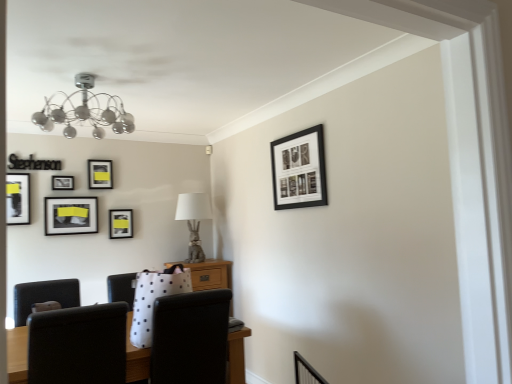
This screenshot has width=512, height=384. Describe the element at coordinates (193, 221) in the screenshot. I see `gray stone rabbit at center` at that location.

In order to click on matte black picture frame at left, positioned as the third picture frame in front-to-back order in this screenshot , I will do `click(71, 215)`.

From the picture: How much space does matte black picture frame at upper left, which is the third picture frame from back to front, occupy vertically?

4.93 inches.

At what (x,y) coordinates should I click in order to perform the action: click on black matte picture frame at upper right, which is counted as the 6th picture frame, starting from the left. Please return your answer as a coordinate pair (x, y). Looking at the image, I should click on (298, 169).

The height and width of the screenshot is (384, 512). Find the location of `black fabric chair at lower center`. black fabric chair at lower center is located at coordinates (190, 338).

This screenshot has height=384, width=512. I want to click on the 4th picture frame in front of the gray stone rabbit at center, counting from the anchor's position, so click(298, 169).

From a real-world perspective, is gray stone rabbit at center over black matte picture frame at upper right, acting as the 6th picture frame starting from the back?

No.

Is gray stone rabbit at center facing towards black matte picture frame at upper right, the 1th picture frame positioned from the front?

Yes, gray stone rabbit at center faces towards black matte picture frame at upper right, the 1th picture frame positioned from the front.

Considering their positions, is gray stone rabbit at center located in front of or behind black matte picture frame at upper right, arranged as the first picture frame when viewed from the right?

gray stone rabbit at center is behind black matte picture frame at upper right, arranged as the first picture frame when viewed from the right.

Consider the image. Is matte black picture frame at upper left, placed as the fifth picture frame when sorted from front to back, facing towards black fabric chair at lower center?

No, matte black picture frame at upper left, placed as the fifth picture frame when sorted from front to back, is not aimed at black fabric chair at lower center.

Would you say black fabric chair at lower center is part of matte black picture frame at upper left, which is counted as the second picture frame, starting from the back,'s contents?

No, matte black picture frame at upper left, which is counted as the second picture frame, starting from the back, does not contain black fabric chair at lower center.

What's the angular difference between matte black picture frame at upper left, which is the third picture frame in right-to-left order, and black fabric chair at lower center's facing directions?

The angle between the facing direction of matte black picture frame at upper left, which is the third picture frame in right-to-left order, and the facing direction of black fabric chair at lower center is 179 degrees.

Starting from the black fabric chair at lower center, which picture frame is the 2nd one to the left? Please provide its 2D coordinates.

[(100, 174)]

Is matte black picture frame at center left, which is counted as the sixth picture frame, starting from the front, oriented away from black fabric chair at lower center?

No, matte black picture frame at center left, which is counted as the sixth picture frame, starting from the front, is not facing the opposite direction of black fabric chair at lower center.

Looking at this image, from the image's perspective, who appears lower, matte black picture frame at center left, which ranks as the first picture frame in back-to-front order, or black fabric chair at lower center?

black fabric chair at lower center is shown below in the image.

Is matte black picture frame at center left, which ranks as the 5th picture frame in left-to-right order, to the left or to the right of black fabric chair at lower center in the image?

Based on their positions, matte black picture frame at center left, which ranks as the 5th picture frame in left-to-right order, is located to the left of black fabric chair at lower center.

Which of these two, matte black picture frame at upper left, which is counted as the second picture frame, starting from the back, or matte black picture frame at center left, which ranks as the 5th picture frame in left-to-right order, is thinner?

Thinner between the two is matte black picture frame at upper left, which is counted as the second picture frame, starting from the back.

Is matte black picture frame at center left, the second picture frame from the right, at the back of matte black picture frame at upper left, which is the third picture frame in right-to-left order?

No, matte black picture frame at upper left, which is the third picture frame in right-to-left order,'s orientation is not away from matte black picture frame at center left, the second picture frame from the right.

Is point (102, 174) less distant than point (118, 232)?

Yes.

Which of these two, metallic chrome chandelier at upper center or matte black picture frame at upper left, the 2th picture frame in the left-to-right sequence, is bigger?

Bigger between the two is metallic chrome chandelier at upper center.

Who is shorter, metallic chrome chandelier at upper center or matte black picture frame at upper left, the 2th picture frame in the left-to-right sequence?

With less height is matte black picture frame at upper left, the 2th picture frame in the left-to-right sequence.

Considering the positions of objects metallic chrome chandelier at upper center and matte black picture frame at upper left, which is the third picture frame from back to front, in the image provided, who is more to the left, metallic chrome chandelier at upper center or matte black picture frame at upper left, which is the third picture frame from back to front,?

Positioned to the left is matte black picture frame at upper left, which is the third picture frame from back to front.

Does metallic chrome chandelier at upper center lie in front of matte black picture frame at upper left, the 2th picture frame in the left-to-right sequence?

Yes, the depth of metallic chrome chandelier at upper center is less than that of matte black picture frame at upper left, the 2th picture frame in the left-to-right sequence.

What's the angular difference between gray stone rabbit at center and matte black picture frame at left, positioned as the 5th picture frame in back-to-front order,'s facing directions?

The angular difference between gray stone rabbit at center and matte black picture frame at left, positioned as the 5th picture frame in back-to-front order, is 4.13 degrees.

Who is more distant, gray stone rabbit at center or matte black picture frame at left, the second picture frame from the front?

gray stone rabbit at center.

From the picture: Who is shorter, gray stone rabbit at center or matte black picture frame at left, the second picture frame from the front?

matte black picture frame at left, the second picture frame from the front.

Find the location of a particular element. The height and width of the screenshot is (384, 512). table lamp that is on the right side of matte black picture frame at left, which is the 1th picture frame from left to right is located at coordinates (193, 221).

In the image, is matte black picture frame at left, positioned as the 5th picture frame in back-to-front order, positioned in front of or behind black fabric chair at lower center?

Visually, matte black picture frame at left, positioned as the 5th picture frame in back-to-front order, is located behind black fabric chair at lower center.

Based on the photo, from the image's perspective, is matte black picture frame at left, which is the 1th picture frame from left to right, located beneath black fabric chair at lower center?

No, from the image's perspective, matte black picture frame at left, which is the 1th picture frame from left to right, is not below black fabric chair at lower center.

Is matte black picture frame at left, positioned as the 5th picture frame in back-to-front order, directly adjacent to black fabric chair at lower center?

matte black picture frame at left, positioned as the 5th picture frame in back-to-front order, and black fabric chair at lower center are not in contact.

From a real-world perspective, is matte black picture frame at left, positioned as the 5th picture frame in back-to-front order, physically below black fabric chair at lower center?

No, from a real-world perspective, matte black picture frame at left, positioned as the 5th picture frame in back-to-front order, is not below black fabric chair at lower center.

Where is `table lamp that is on the left side of black matte picture frame at upper right, the 1th picture frame positioned from the front`? The image size is (512, 384). table lamp that is on the left side of black matte picture frame at upper right, the 1th picture frame positioned from the front is located at coordinates coord(193,221).

Identify the location of chair lying in front of the matte black picture frame at upper left, which is the third picture frame in right-to-left order. Image resolution: width=512 pixels, height=384 pixels. (190, 338).

When comparing their distances from metallic chrome chandelier at upper center, does gray stone rabbit at center or matte black picture frame at upper left, which is the third picture frame in right-to-left order, seem further?

Among the two, gray stone rabbit at center is located further to metallic chrome chandelier at upper center.

Which object lies further to the anchor point matte black picture frame at upper left, which ranks as the fourth picture frame in front-to-back order, black fabric chair at lower center or black matte picture frame at upper right, acting as the 6th picture frame starting from the back?

black fabric chair at lower center is further to matte black picture frame at upper left, which ranks as the fourth picture frame in front-to-back order.

Estimate the real-world distances between objects in this image. Which object is closer to matte black picture frame at upper left, which is counted as the second picture frame, starting from the back, matte black picture frame at left, positioned as the third picture frame in front-to-back order, or black fabric chair at lower center?

The object closer to matte black picture frame at upper left, which is counted as the second picture frame, starting from the back, is matte black picture frame at left, positioned as the third picture frame in front-to-back order.

Looking at the image, which one is located closer to metallic chrome chandelier at upper center, matte black picture frame at left, positioned as the 5th picture frame in back-to-front order, or gray stone rabbit at center?

The object closer to metallic chrome chandelier at upper center is matte black picture frame at left, positioned as the 5th picture frame in back-to-front order.

Looking at the image, which one is located closer to gray stone rabbit at center, matte black picture frame at upper left, placed as the fifth picture frame when sorted from front to back, or matte black picture frame at upper left, the 2th picture frame in the left-to-right sequence?

Based on the image, matte black picture frame at upper left, placed as the fifth picture frame when sorted from front to back, appears to be nearer to gray stone rabbit at center.

Estimate the real-world distances between objects in this image. Which object is closer to gray stone rabbit at center, black fabric chair at lower center or matte black picture frame at left, positioned as the sixth picture frame in right-to-left order?

matte black picture frame at left, positioned as the sixth picture frame in right-to-left order, is closer to gray stone rabbit at center.

When comparing their distances from metallic chrome chandelier at upper center, does matte black picture frame at upper left, the fourth picture frame viewed from the left, or matte black picture frame at upper left, the 5th picture frame in the right-to-left sequence, seem further?

Based on the image, matte black picture frame at upper left, the 5th picture frame in the right-to-left sequence, appears to be further to metallic chrome chandelier at upper center.

Which object lies nearer to the anchor point matte black picture frame at center left, which ranks as the first picture frame in back-to-front order, black fabric chair at lower center or matte black picture frame at upper left, the 2th picture frame in the left-to-right sequence?

matte black picture frame at upper left, the 2th picture frame in the left-to-right sequence, lies closer to matte black picture frame at center left, which ranks as the first picture frame in back-to-front order, than the other object.

Where is `lamp between black fabric chair at lower center and matte black picture frame at upper left, the 5th picture frame in the right-to-left sequence, along the z-axis`? lamp between black fabric chair at lower center and matte black picture frame at upper left, the 5th picture frame in the right-to-left sequence, along the z-axis is located at coordinates (85, 111).

You are a GUI agent. You are given a task and a screenshot of the screen. Output one action in this format:
    pyautogui.click(x=<x>, y=<y>)
    Task: Click on the table lamp situated between matte black picture frame at upper left, the 5th picture frame in the right-to-left sequence, and black matte picture frame at upper right, arranged as the first picture frame when viewed from the right, from left to right
    This screenshot has height=384, width=512.
    Given the screenshot: What is the action you would take?
    pyautogui.click(x=193, y=221)

Locate an element on the screen. table lamp between matte black picture frame at left, positioned as the 4th picture frame in right-to-left order, and black matte picture frame at upper right, the 1th picture frame positioned from the front, in the horizontal direction is located at coordinates (193, 221).

The width and height of the screenshot is (512, 384). What are the coordinates of `lamp between black fabric chair at lower center and gray stone rabbit at center along the z-axis` in the screenshot? It's located at (85, 111).